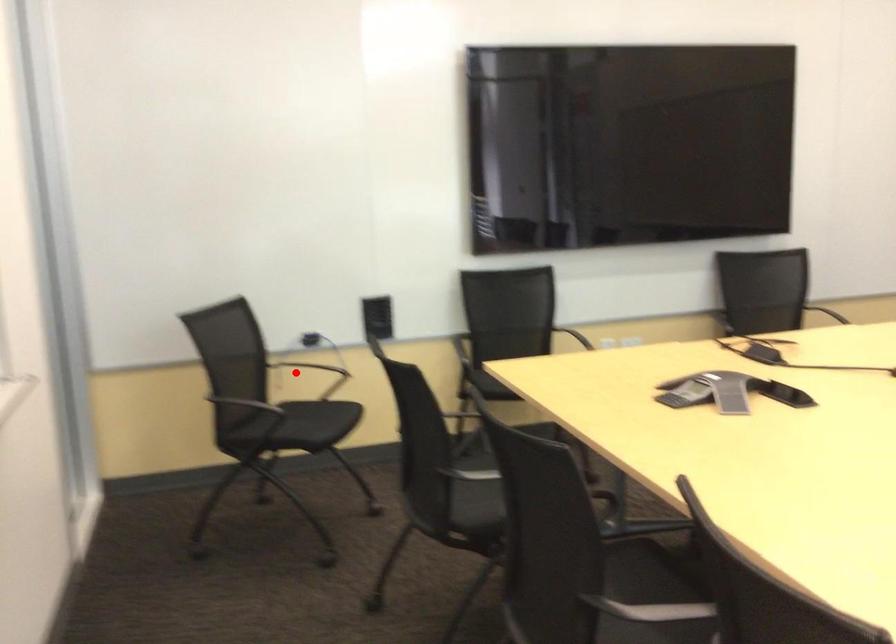
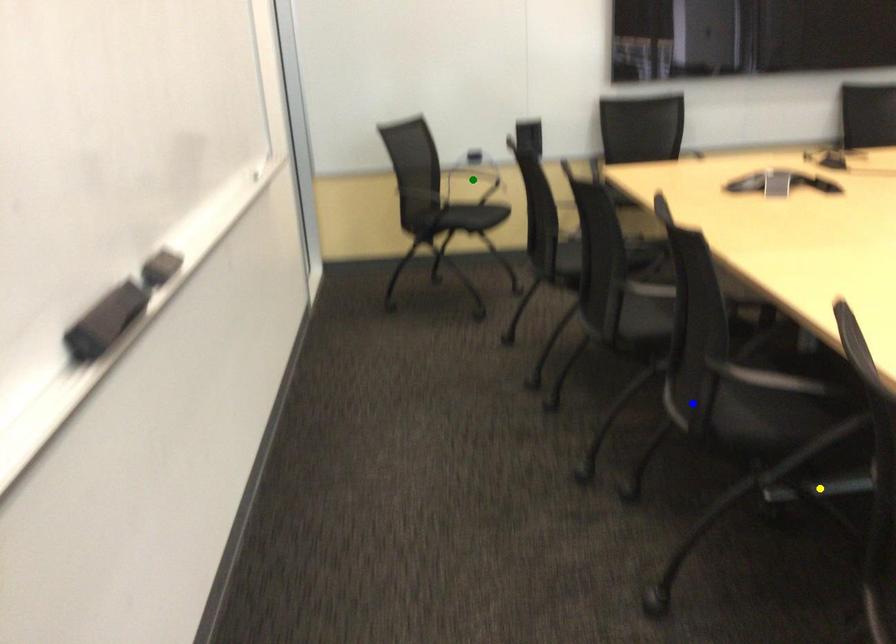
Question: I am providing you with two images of the same scene from different viewpoints. A red point is marked on the first image. You are given multiple points on the second image. Which spot in image 2 lines up with the point in image 1?

Choices:
 (A) blue point
 (B) yellow point
 (C) green point

Answer: (C)